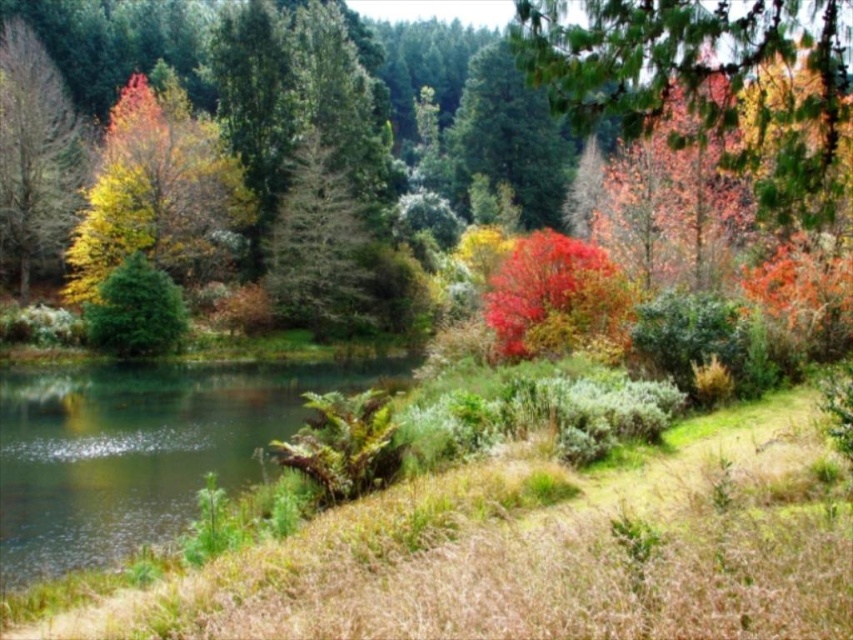
Question: From the image, what is the correct spatial relationship of clear water at lower left in relation to green matte tree at center?

Choices:
 (A) right
 (B) left

Answer: (B)

Question: Which point appears farthest from the camera in this image?

Choices:
 (A) (38, 147)
 (B) (340, 333)

Answer: (B)

Question: Estimate the real-world distances between objects in this image. Which object is closer to the clear water at lower left?

Choices:
 (A) yellow matte tree at left
 (B) green matte tree at center

Answer: (B)

Question: Is yellow matte tree at left positioned at the back of green matte tree at center?

Choices:
 (A) no
 (B) yes

Answer: (A)

Question: Does clear water at lower left have a greater width compared to green matte tree at center?

Choices:
 (A) no
 (B) yes

Answer: (B)

Question: Among these points, which one is farthest from the camera?

Choices:
 (A) (352, 234)
 (B) (41, 550)

Answer: (A)